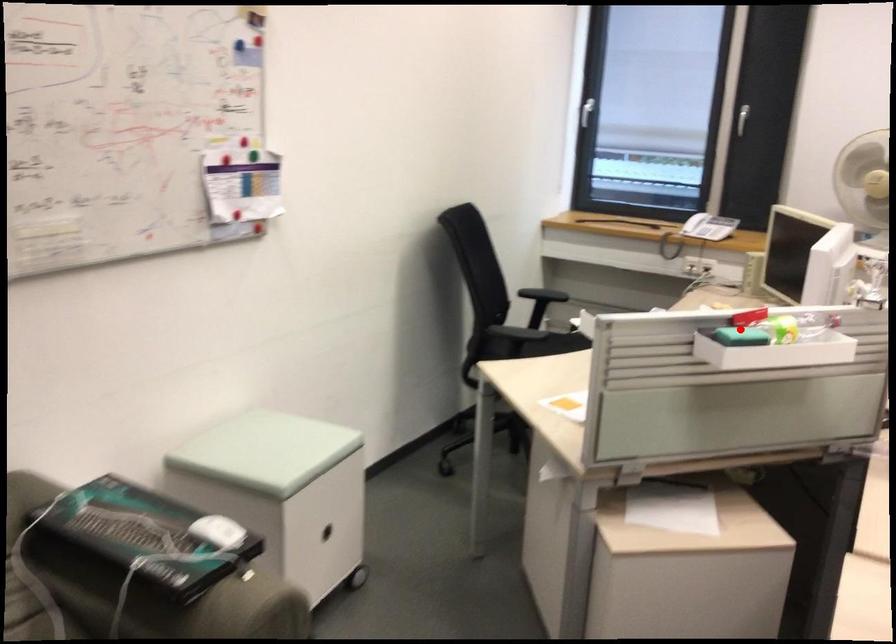
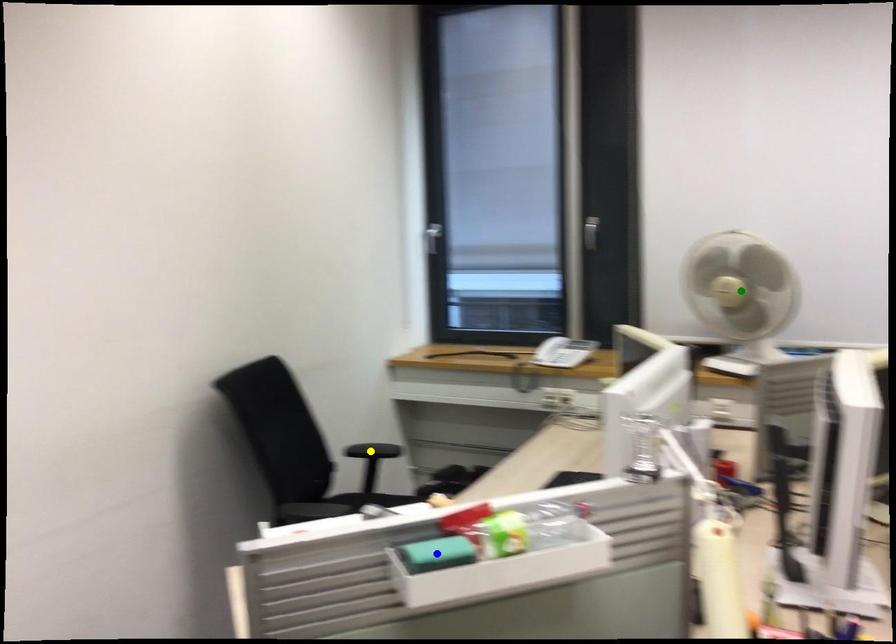
Question: I am providing you with two images of the same scene from different viewpoints. A red point is marked on the first image. You are given multiple points on the second image. Can you choose the point in image 2 that corresponds to the point in image 1?

Choices:
 (A) yellow point
 (B) blue point
 (C) green point

Answer: (B)